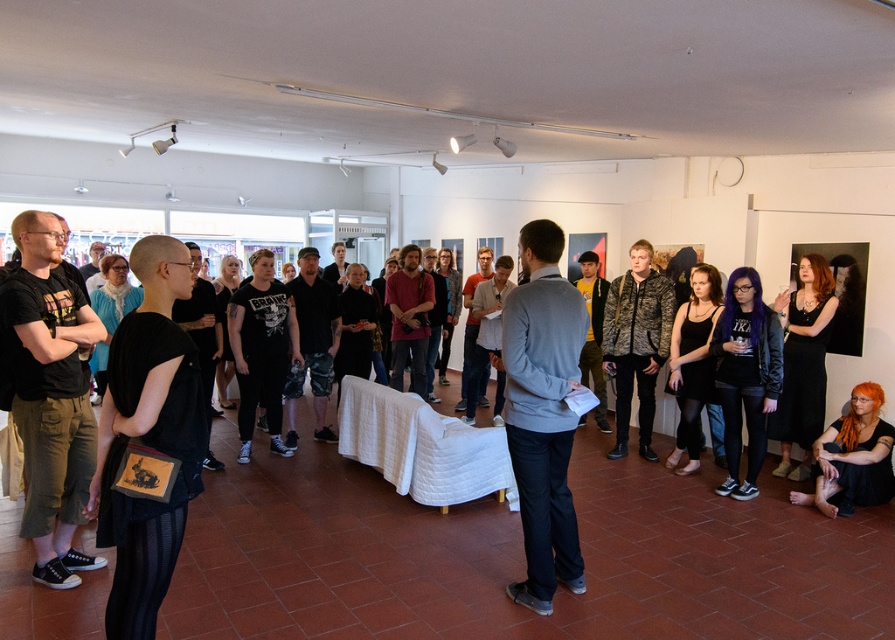
Can you confirm if gray sweater at center is thinner than orange hair at lower right?

Yes, gray sweater at center is thinner than orange hair at lower right.

Is point (570, 388) positioned behind point (857, 422)?

No, (570, 388) is closer to viewer.

Find the location of a particular element. gray sweater at center is located at coordinates (542, 412).